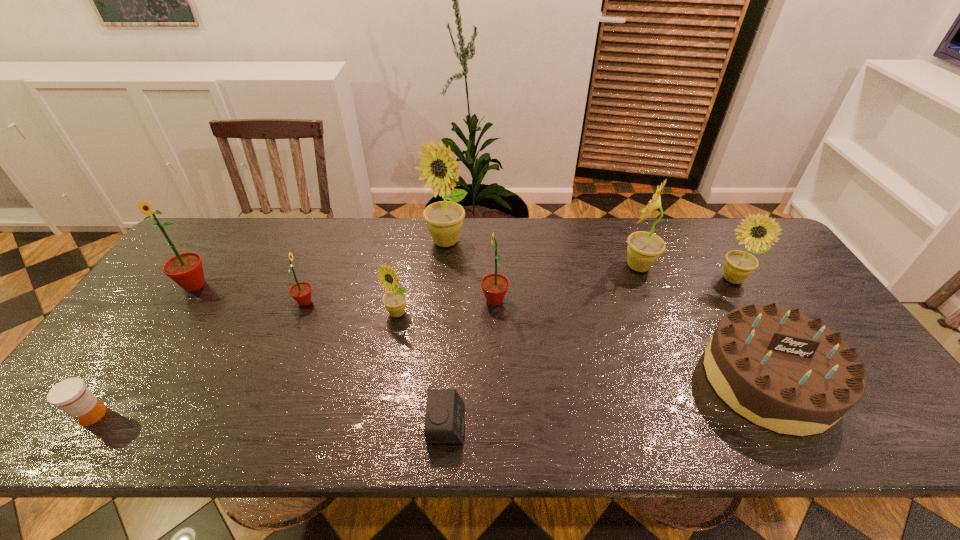
The height and width of the screenshot is (540, 960). What are the coordinates of `the sixth sunflower from right to left` in the screenshot? It's located at (301, 292).

Where is `the smallest green sunflower`? The image size is (960, 540). the smallest green sunflower is located at coordinates (301, 292).

The image size is (960, 540). What are the coordinates of `the nearest yellow sunflower` in the screenshot? It's located at point(394,300).

Find the location of a particular element. birthday cake is located at coordinates (783, 371).

At what (x,y) coordinates should I click in order to perform the action: click on brown birthday cake. Please return your answer as a coordinate pair (x, y). The height and width of the screenshot is (540, 960). Looking at the image, I should click on pos(783,371).

Find the location of a particular element. The image size is (960, 540). the second shortest object is located at coordinates (71, 395).

The height and width of the screenshot is (540, 960). I want to click on orange medicine, so click(x=71, y=395).

The width and height of the screenshot is (960, 540). Identify the location of alarm clock. (444, 421).

You are a GUI agent. You are given a task and a screenshot of the screen. Output one action in this format:
    pyautogui.click(x=<x>, y=<y>)
    Task: Click on the black alarm clock
    
    Given the screenshot: What is the action you would take?
    pyautogui.click(x=444, y=421)

Identify the location of free space located on the face of the biggest yellow sunflower. The width and height of the screenshot is (960, 540). (435, 352).